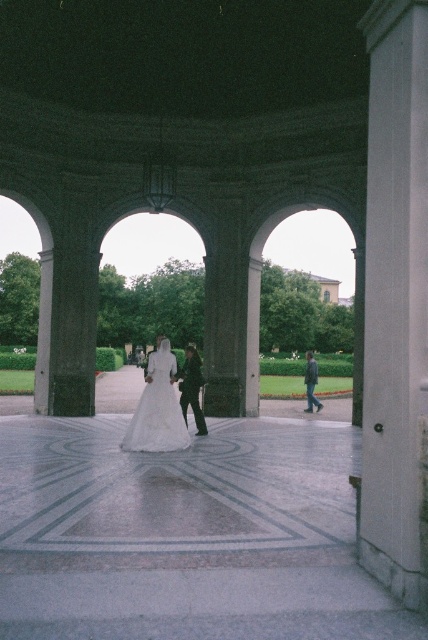
Between point (397, 282) and point (186, 403), which one is positioned in front?

Point (397, 282) is in front.

Does point (406, 381) lie behind point (202, 422)?

No, (406, 381) is in front of (202, 422).

Is point (422, 273) closer to viewer compared to point (189, 356)?

Yes, it is in front of point (189, 356).

Find the location of a particular element. white smooth pillar at right is located at coordinates (395, 301).

Describe the element at coordinates (157, 408) in the screenshot. The height and width of the screenshot is (640, 428). I see `white satin dress at center` at that location.

Who is positioned more to the left, white satin dress at center or dark green jacket at center?

white satin dress at center

Is point (166, 342) closer to viewer compared to point (309, 355)?

Yes, it is in front of point (309, 355).

Find the location of a particular element. This screenshot has height=640, width=428. white satin dress at center is located at coordinates (157, 408).

Is white smooth pillar at right smaller than white satin dress at center?

Indeed, white smooth pillar at right has a smaller size compared to white satin dress at center.

Can you confirm if white smooth pillar at right is positioned to the right of white satin dress at center?

Correct, you'll find white smooth pillar at right to the right of white satin dress at center.

Where is `white smooth pillar at right`? This screenshot has height=640, width=428. white smooth pillar at right is located at coordinates (395, 301).